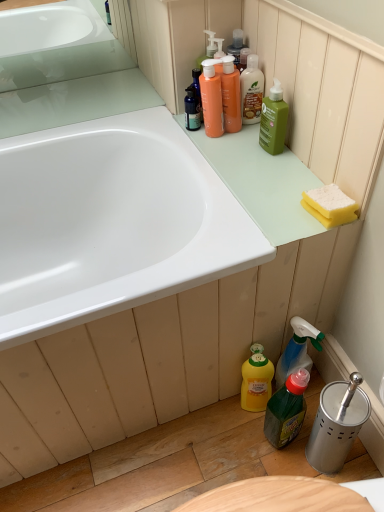
Locate an element on the screen. This screenshot has width=384, height=512. free point to the left of translucent plastic bottle at upper center, which appears as the first cleaning product when viewed from the top is located at coordinates (179, 130).